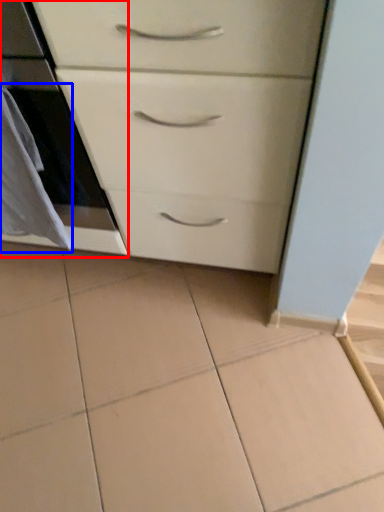
Question: Among these objects, which one is farthest to the camera, oven (highlighted by a red box) or material (highlighted by a blue box)?

Choices:
 (A) oven
 (B) material

Answer: (B)